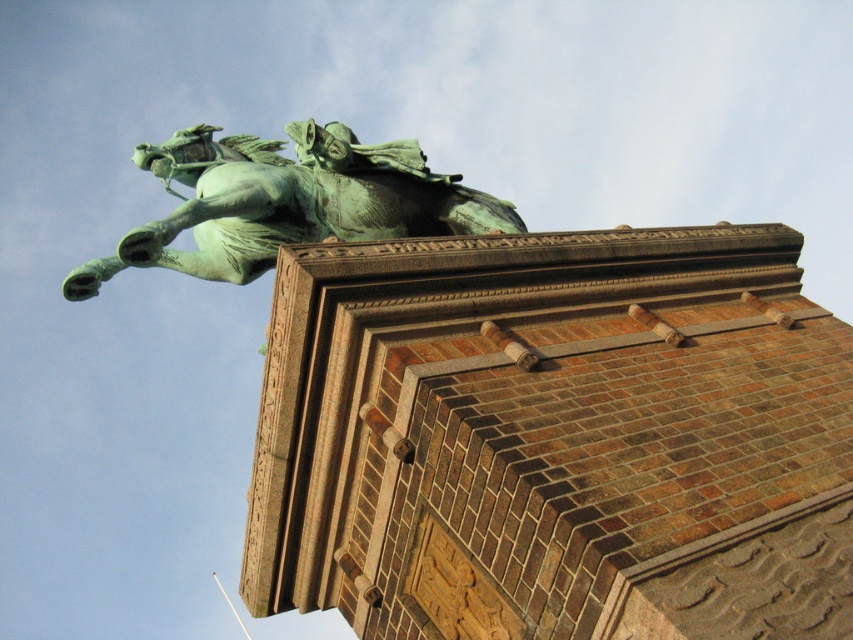
You are standing in front of the statue and want to take a photo of both the brown brick tower at upper center and the green patina statue at upper center. Which object should you position to your left to ensure both are in the frame?

The brown brick tower at upper center is to the right of the green patina statue at upper center. To include both in your photo, position the green patina statue at upper center to your left side so that the brown brick tower at upper center will naturally be on the right side of the frame.

You are standing in front of the verdigris statue of a horse and rider on the brick pedestal. You notice two points on the statue marked at coordinates point (422, 316) and point (177, 211). Which point is closer to you?

Point (422, 316) is closer to the viewer than point (177, 211).